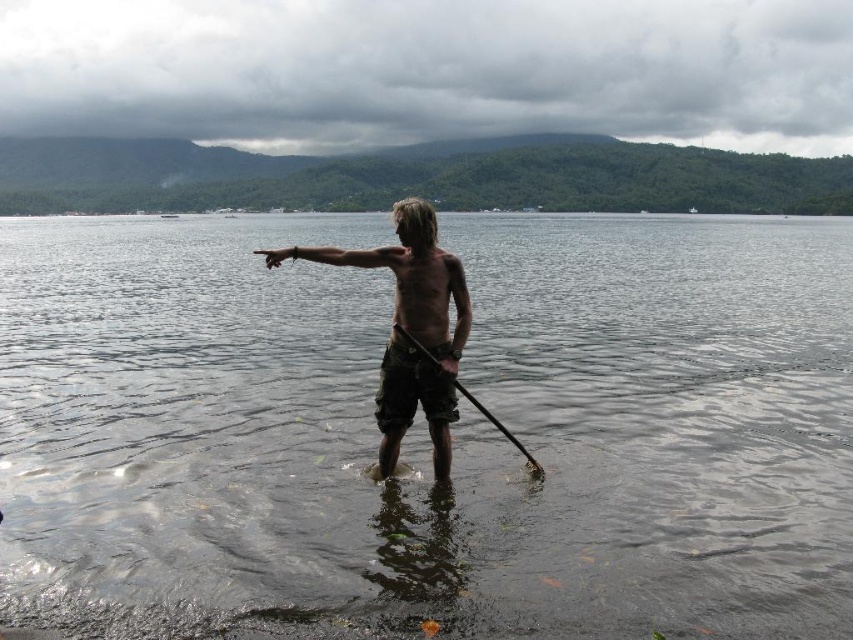
Question: Does clear water at center have a lesser width compared to brown camouflage shorts at center?

Choices:
 (A) no
 (B) yes

Answer: (A)

Question: Which of the following is the closest to the observer?

Choices:
 (A) brown camouflage shorts at center
 (B) clear water at center
 (C) wooden smooth paddle at center

Answer: (B)

Question: Which of the following is the farthest from the observer?

Choices:
 (A) clear water at center
 (B) wooden smooth paddle at center
 (C) brown camouflage shorts at center

Answer: (B)

Question: Is clear water at center wider than wooden smooth paddle at center?

Choices:
 (A) yes
 (B) no

Answer: (A)

Question: Which point is closer to the camera taking this photo?

Choices:
 (A) (648, 493)
 (B) (437, 365)
 (C) (439, 368)

Answer: (C)

Question: Is brown camouflage shorts at center to the left of wooden smooth paddle at center from the viewer's perspective?

Choices:
 (A) yes
 (B) no

Answer: (A)